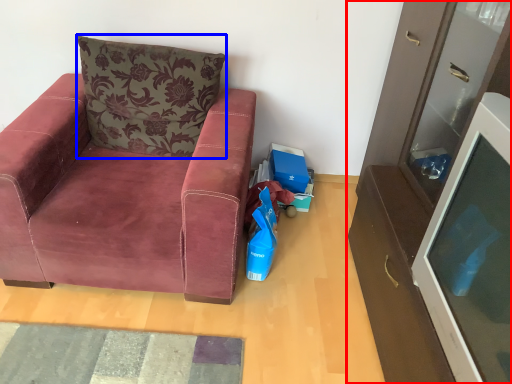
Question: Which of the following is the closest to the observer, cabinetry (highlighted by a red box) or pillow (highlighted by a blue box)?

Choices:
 (A) cabinetry
 (B) pillow

Answer: (A)